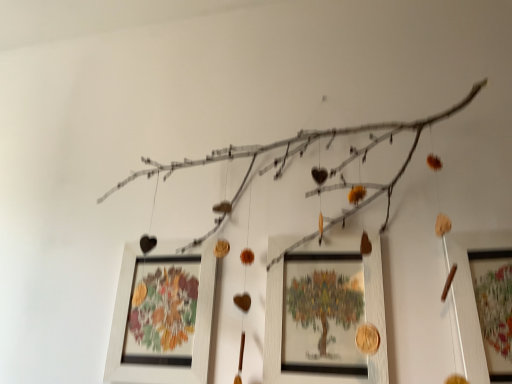
Question: Does wooden picture frame at right, arranged as the third picture frame when viewed from the left, have a smaller size compared to wooden frame at center, which appears as the first picture frame when viewed from the left?

Choices:
 (A) no
 (B) yes

Answer: (A)

Question: Considering the relative positions of wooden picture frame at right, arranged as the third picture frame when viewed from the left, and wooden frame at center, which appears as the first picture frame when viewed from the left, in the image provided, is wooden picture frame at right, arranged as the third picture frame when viewed from the left, to the right of wooden frame at center, which appears as the first picture frame when viewed from the left, from the viewer's perspective?

Choices:
 (A) no
 (B) yes

Answer: (B)

Question: From a real-world perspective, is wooden picture frame at right, arranged as the third picture frame when viewed from the left, on wooden frame at center, which appears as the first picture frame when viewed from the left?

Choices:
 (A) yes
 (B) no

Answer: (A)

Question: Is wooden picture frame at right, arranged as the third picture frame when viewed from the left, looking in the opposite direction of wooden frame at center, the third picture frame positioned from the right?

Choices:
 (A) yes
 (B) no

Answer: (B)

Question: Is the surface of wooden picture frame at right, which is counted as the 1th picture frame, starting from the right, in direct contact with wooden frame at center, which appears as the first picture frame when viewed from the left?

Choices:
 (A) no
 (B) yes

Answer: (A)

Question: Could wooden frame at center, the third picture frame positioned from the right, be considered to be inside wooden picture frame at right, arranged as the third picture frame when viewed from the left?

Choices:
 (A) yes
 (B) no

Answer: (B)

Question: Is wooden framed picture at center, marked as the 2th picture frame in a left-to-right arrangement, smaller than wooden frame at center, which appears as the first picture frame when viewed from the left?

Choices:
 (A) yes
 (B) no

Answer: (A)

Question: From a real-world perspective, is wooden framed picture at center, the second picture frame viewed from the right, positioned under wooden frame at center, which appears as the first picture frame when viewed from the left, based on gravity?

Choices:
 (A) no
 (B) yes

Answer: (A)

Question: Is wooden framed picture at center, marked as the 2th picture frame in a left-to-right arrangement, completely or partially outside of wooden frame at center, which appears as the first picture frame when viewed from the left?

Choices:
 (A) yes
 (B) no

Answer: (A)

Question: Does wooden framed picture at center, the second picture frame viewed from the right, have a larger size compared to wooden frame at center, which appears as the first picture frame when viewed from the left?

Choices:
 (A) yes
 (B) no

Answer: (B)

Question: From a real-world perspective, does wooden framed picture at center, marked as the 2th picture frame in a left-to-right arrangement, stand above wooden frame at center, which appears as the first picture frame when viewed from the left?

Choices:
 (A) no
 (B) yes

Answer: (B)

Question: Considering the relative sizes of wooden framed picture at center, marked as the 2th picture frame in a left-to-right arrangement, and wooden frame at center, which appears as the first picture frame when viewed from the left, in the image provided, is wooden framed picture at center, marked as the 2th picture frame in a left-to-right arrangement, thinner than wooden frame at center, which appears as the first picture frame when viewed from the left,?

Choices:
 (A) no
 (B) yes

Answer: (B)

Question: Considering the relative positions of wooden frame at center, which appears as the first picture frame when viewed from the left, and wooden picture frame at right, arranged as the third picture frame when viewed from the left, in the image provided, is wooden frame at center, which appears as the first picture frame when viewed from the left, in front of wooden picture frame at right, arranged as the third picture frame when viewed from the left,?

Choices:
 (A) no
 (B) yes

Answer: (A)